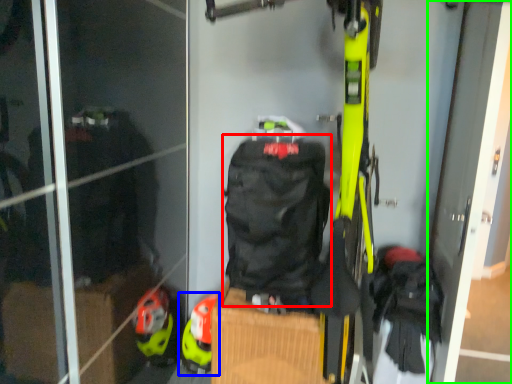
Question: Based on their relative distances, which object is nearer to backpack (highlighted by a red box)? Choose from footwear (highlighted by a blue box) and screen door (highlighted by a green box).

Choices:
 (A) footwear
 (B) screen door

Answer: (A)